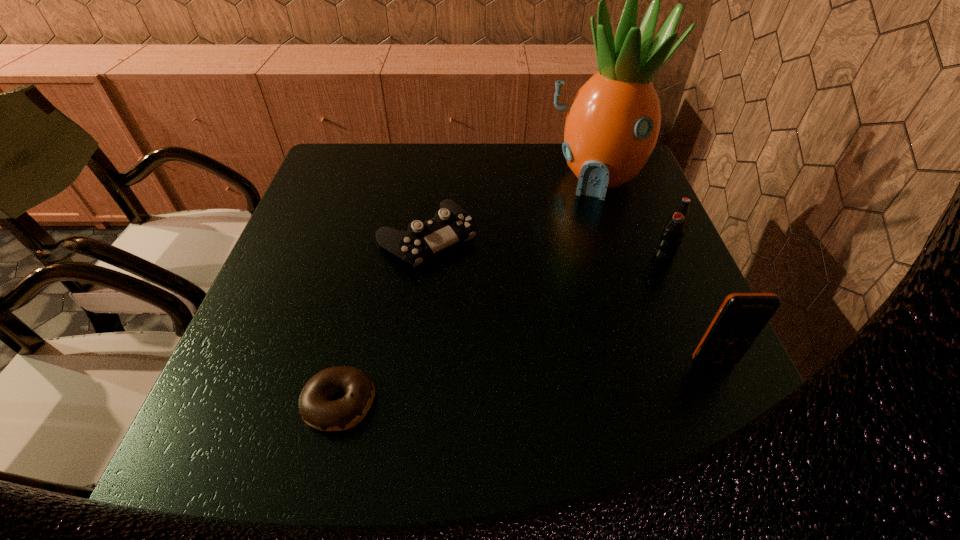
Image resolution: width=960 pixels, height=540 pixels. I want to click on free space on the desktop that is between the shortest object and the cellular telephone and is positioned on the front label of the third shortest object, so click(x=573, y=377).

Locate an element on the screen. The height and width of the screenshot is (540, 960). free spot on the desktop that is between the doughnut and the fourth farthest object and is positioned on the surface of the second shortest object is located at coordinates (570, 377).

The image size is (960, 540). In order to click on vacant space on the desktop that is between the doughnut and the cellular telephone and is positioned at the entrance of the pineapple in this screenshot , I will do `click(539, 380)`.